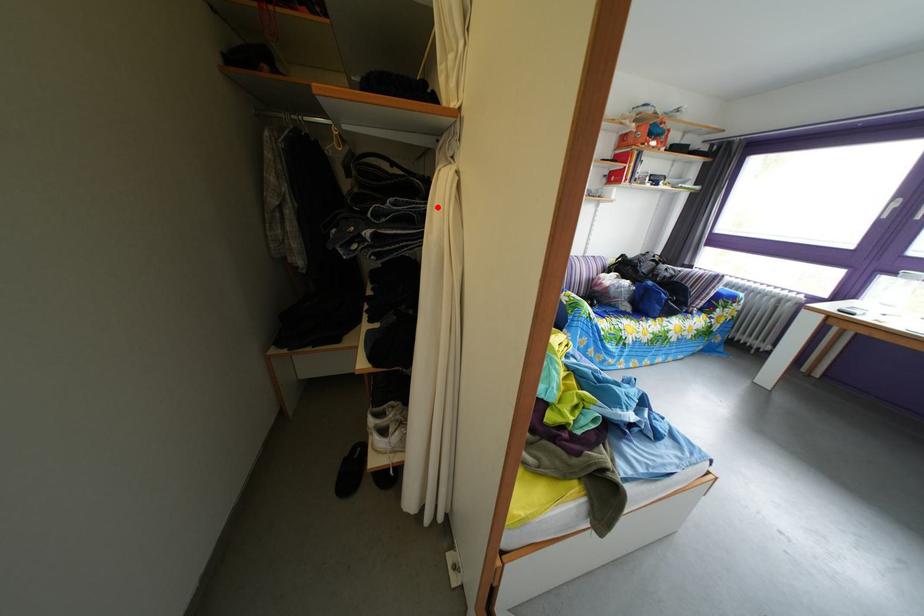
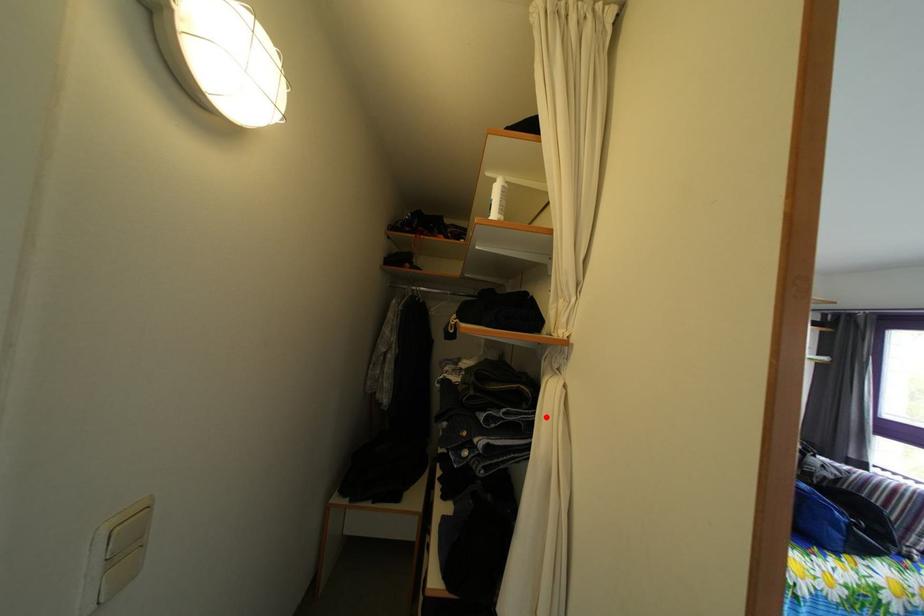
I am providing you with two images of the same scene from different viewpoints. A red point is marked on the first image and another point is marked on the second image. Does the point marked in image1 correspond to the same location as the one in image2?

Yes